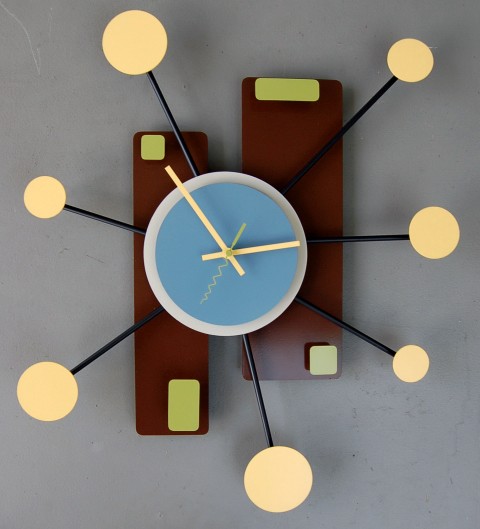
This screenshot has width=480, height=529. What are the coordinates of `empty space bottom left wall` in the screenshot? It's located at (119, 477).